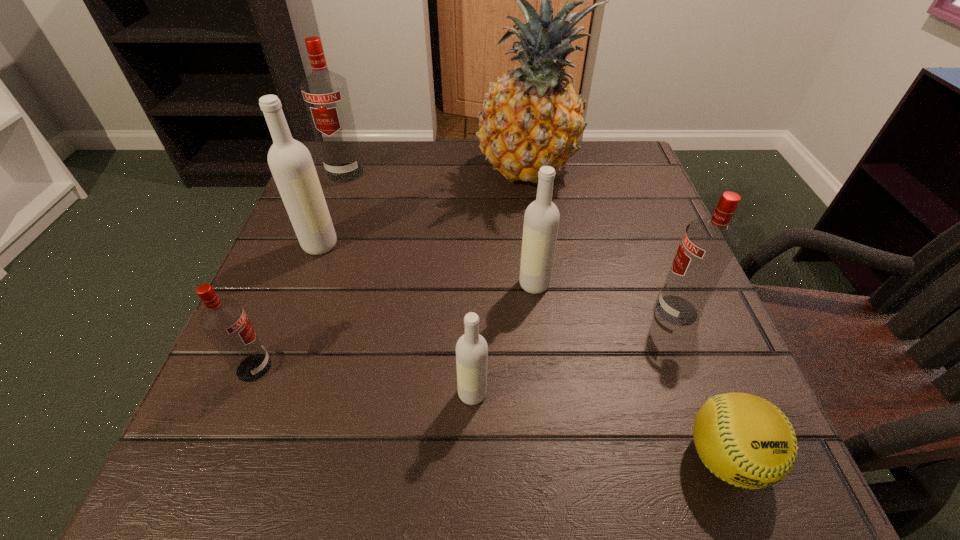
Find the location of a particular element. This screenshot has height=540, width=960. vacant space situated on the front label of the rightmost vodka is located at coordinates (573, 310).

Locate an element on the screen. The height and width of the screenshot is (540, 960). vacant space situated 0.110m on the front label of the rightmost vodka is located at coordinates (590, 310).

Find the location of a particular element. The width and height of the screenshot is (960, 540). vacant point located 0.250m on the front label of the nearest red vodka is located at coordinates (434, 368).

Find the location of a particular element. vacant area situated 0.150m on the right of the second white vodka from right to left is located at coordinates (588, 394).

Where is `pineapple positioned at the far edge`? pineapple positioned at the far edge is located at coordinates (532, 117).

At what (x,y) coordinates should I click in order to perform the action: click on vodka located in the far edge section of the desktop. Please return your answer as a coordinate pair (x, y). Looking at the image, I should click on (325, 93).

Identify the location of object at the near edge. This screenshot has height=540, width=960. (745, 440).

This screenshot has height=540, width=960. In order to click on pineapple that is at the right edge in this screenshot , I will do `click(532, 117)`.

Locate an element on the screen. This screenshot has height=540, width=960. vodka present at the right edge is located at coordinates (708, 245).

You are a GUI agent. You are given a task and a screenshot of the screen. Output one action in this format:
    pyautogui.click(x=<x>, y=<y>)
    Task: Click on the softball that is at the right edge
    Image resolution: width=960 pixels, height=540 pixels.
    Given the screenshot: What is the action you would take?
    pyautogui.click(x=745, y=440)